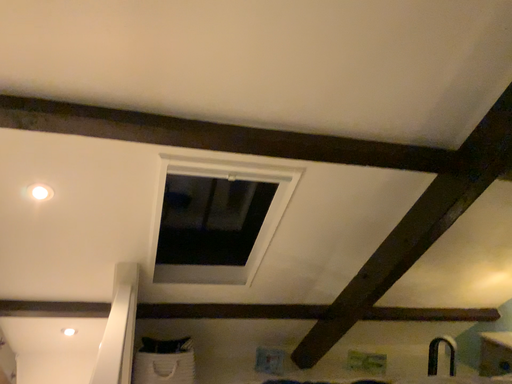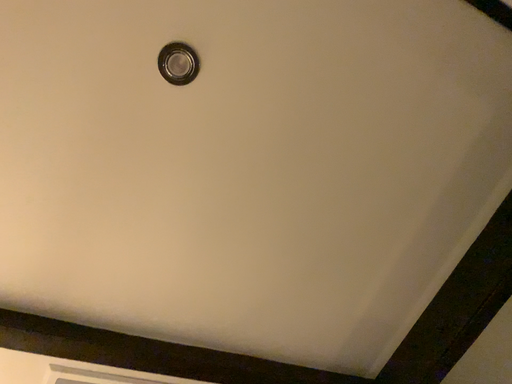
Question: How did the camera likely rotate when shooting the video?

Choices:
 (A) rotated downward
 (B) rotated upward

Answer: (B)